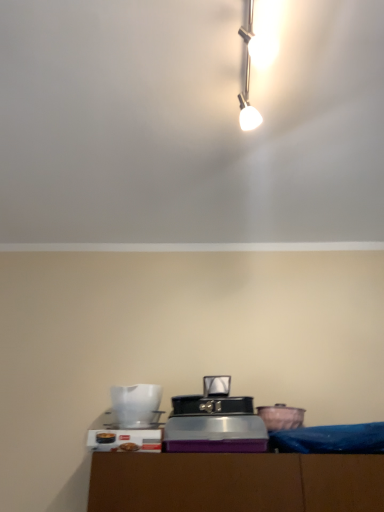
Question: Considering the relative sizes of white plastic toaster at lower center, which appears as the 1th appliance when viewed from the left, and white glossy pitcher at lower left, arranged as the 2th appliance when viewed from the left, in the image provided, is white plastic toaster at lower center, which appears as the 1th appliance when viewed from the left, shorter than white glossy pitcher at lower left, arranged as the 2th appliance when viewed from the left,?

Choices:
 (A) yes
 (B) no

Answer: (A)

Question: Is white plastic toaster at lower center, marked as the third appliance in a right-to-left arrangement, at the left side of white glossy pitcher at lower left, the second appliance from the right?

Choices:
 (A) no
 (B) yes

Answer: (B)

Question: Is white plastic toaster at lower center, marked as the third appliance in a right-to-left arrangement, positioned behind white glossy pitcher at lower left, the second appliance from the right?

Choices:
 (A) no
 (B) yes

Answer: (A)

Question: Considering the relative sizes of white plastic toaster at lower center, marked as the third appliance in a right-to-left arrangement, and white glossy pitcher at lower left, arranged as the 2th appliance when viewed from the left, in the image provided, is white plastic toaster at lower center, marked as the third appliance in a right-to-left arrangement, wider than white glossy pitcher at lower left, arranged as the 2th appliance when viewed from the left,?

Choices:
 (A) no
 (B) yes

Answer: (A)

Question: From a real-world perspective, is white plastic toaster at lower center, marked as the third appliance in a right-to-left arrangement, positioned over white glossy pitcher at lower left, arranged as the 2th appliance when viewed from the left, based on gravity?

Choices:
 (A) yes
 (B) no

Answer: (B)

Question: Is matte pink ceramic bowl at lower right, acting as the 1th appliance starting from the right, bigger or smaller than white plastic toaster at lower center, marked as the third appliance in a right-to-left arrangement?

Choices:
 (A) big
 (B) small

Answer: (B)

Question: Is point (271, 417) positioned closer to the camera than point (158, 412)?

Choices:
 (A) closer
 (B) farther

Answer: (A)

Question: From a real-world perspective, is matte pink ceramic bowl at lower right, acting as the 1th appliance starting from the right, above or below white plastic toaster at lower center, which appears as the 1th appliance when viewed from the left?

Choices:
 (A) above
 (B) below

Answer: (A)

Question: Is matte pink ceramic bowl at lower right, which is the third appliance in left-to-right order, wider or thinner than white plastic toaster at lower center, marked as the third appliance in a right-to-left arrangement?

Choices:
 (A) wide
 (B) thin

Answer: (B)

Question: Is point (145, 424) closer or farther from the camera than point (119, 423)?

Choices:
 (A) farther
 (B) closer

Answer: (A)

Question: Considering the positions of white plastic toaster at lower center, which appears as the 1th appliance when viewed from the left, and white glossy pitcher at lower left, the second appliance from the right, in the image, is white plastic toaster at lower center, which appears as the 1th appliance when viewed from the left, wider or thinner than white glossy pitcher at lower left, the second appliance from the right,?

Choices:
 (A) wide
 (B) thin

Answer: (B)

Question: Considering the relative positions of white plastic toaster at lower center, marked as the third appliance in a right-to-left arrangement, and white glossy pitcher at lower left, arranged as the 2th appliance when viewed from the left, in the image provided, is white plastic toaster at lower center, marked as the third appliance in a right-to-left arrangement, to the left or to the right of white glossy pitcher at lower left, arranged as the 2th appliance when viewed from the left,?

Choices:
 (A) left
 (B) right

Answer: (A)

Question: Is white plastic toaster at lower center, which appears as the 1th appliance when viewed from the left, spatially inside white glossy pitcher at lower left, arranged as the 2th appliance when viewed from the left, or outside of it?

Choices:
 (A) inside
 (B) outside

Answer: (B)

Question: From a real-world perspective, relative to white plastic toaster at lower center, marked as the third appliance in a right-to-left arrangement, is white glossy pitcher at lower left, arranged as the 2th appliance when viewed from the left, vertically above or below?

Choices:
 (A) above
 (B) below

Answer: (A)

Question: From the image's perspective, is white glossy pitcher at lower left, arranged as the 2th appliance when viewed from the left, located above or below white plastic toaster at lower center, which appears as the 1th appliance when viewed from the left?

Choices:
 (A) below
 (B) above

Answer: (B)